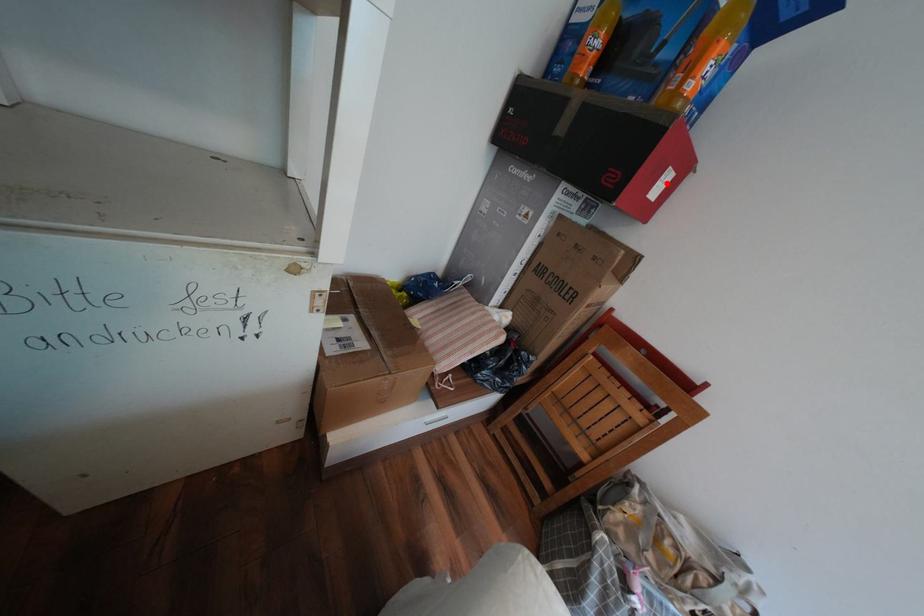
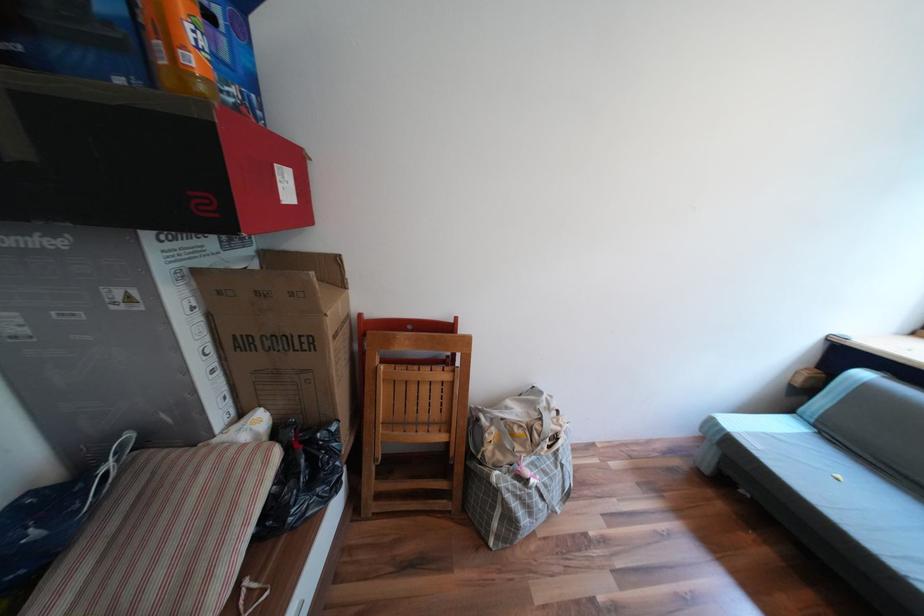
Find the pixel in the second image that matches the highlighted location in the first image.

(289, 185)